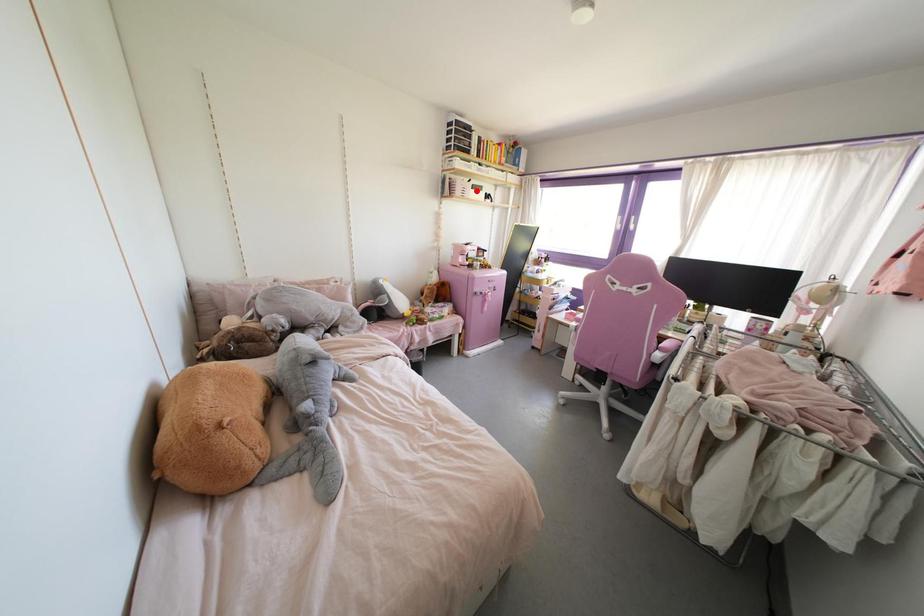
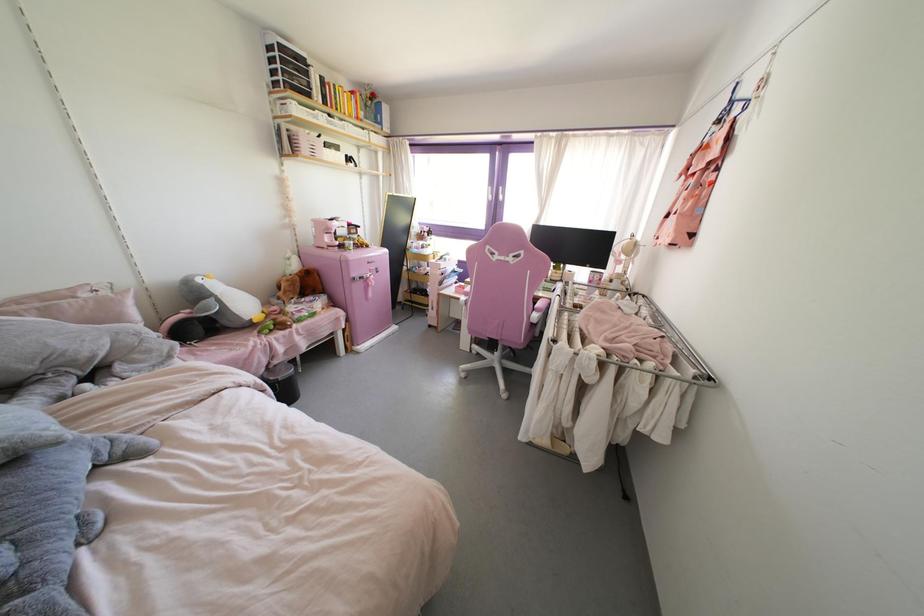
In the second image, find the point that corresponds to the highlighted location in the first image.

(333, 151)